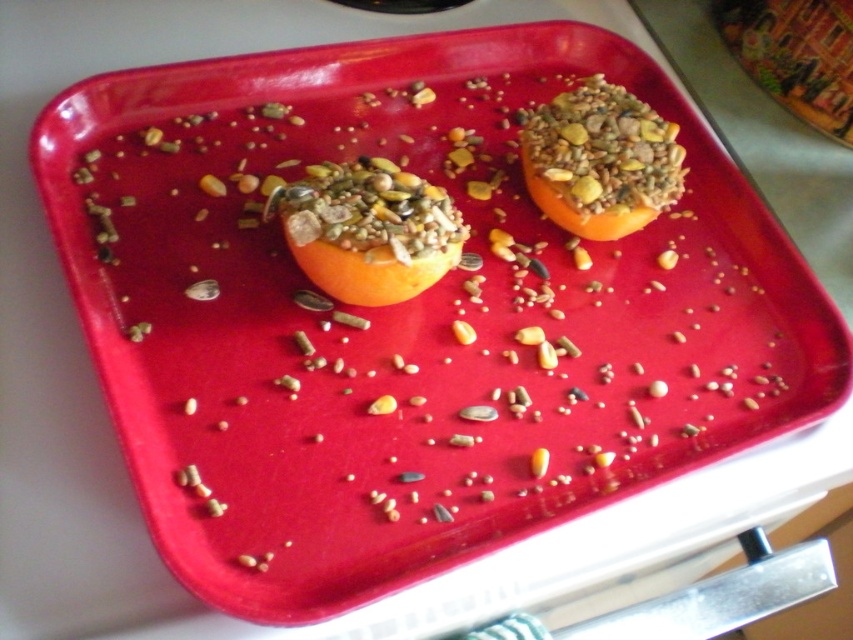
Question: Can you confirm if orange matte at center is bigger than orange textured fruit at upper right?

Choices:
 (A) no
 (B) yes

Answer: (A)

Question: Does orange matte at center appear under orange textured fruit at upper right?

Choices:
 (A) yes
 (B) no

Answer: (A)

Question: Can you confirm if orange matte at center is positioned to the right of orange textured fruit at upper right?

Choices:
 (A) no
 (B) yes

Answer: (A)

Question: Which object is farther from the camera taking this photo?

Choices:
 (A) orange textured fruit at upper right
 (B) orange matte at center

Answer: (A)